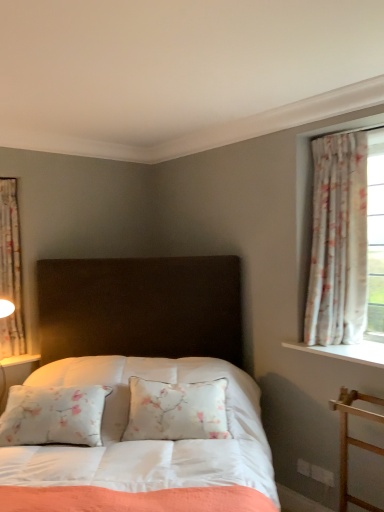
Question: Is floral fabric curtain at right, positioned as the 1th curtain in front-to-back order, surrounding floral fabric curtain at left, placed as the 2th curtain when sorted from right to left?

Choices:
 (A) no
 (B) yes

Answer: (A)

Question: Is floral fabric curtain at right, positioned as the 1th curtain in front-to-back order, not inside floral fabric curtain at left, acting as the first curtain starting from the left?

Choices:
 (A) no
 (B) yes

Answer: (B)

Question: Is floral fabric curtain at right, placed as the first curtain when sorted from right to left, to the left of floral fabric curtain at left, placed as the 2th curtain when sorted from right to left, from the viewer's perspective?

Choices:
 (A) yes
 (B) no

Answer: (B)

Question: Can you confirm if floral fabric curtain at right, which is the second curtain from left to right, is shorter than floral fabric curtain at left, acting as the second curtain starting from the front?

Choices:
 (A) yes
 (B) no

Answer: (B)

Question: Considering the relative sizes of floral fabric curtain at right, positioned as the 1th curtain in front-to-back order, and floral fabric curtain at left, placed as the 2th curtain when sorted from right to left, in the image provided, is floral fabric curtain at right, positioned as the 1th curtain in front-to-back order, taller than floral fabric curtain at left, placed as the 2th curtain when sorted from right to left,?

Choices:
 (A) yes
 (B) no

Answer: (A)

Question: From the image's perspective, is floral fabric curtain at right, positioned as the 1th curtain in front-to-back order, on top of floral fabric curtain at left, placed as the 2th curtain when sorted from right to left?

Choices:
 (A) yes
 (B) no

Answer: (A)

Question: From a real-world perspective, is floral fabric curtain at left, acting as the second curtain starting from the front, located beneath satin white bed at center?

Choices:
 (A) no
 (B) yes

Answer: (A)

Question: From the image's perspective, is floral fabric curtain at left, placed as the 2th curtain when sorted from right to left, located beneath satin white bed at center?

Choices:
 (A) yes
 (B) no

Answer: (B)

Question: Are floral fabric curtain at left, the first curtain when ordered from back to front, and satin white bed at center beside each other?

Choices:
 (A) no
 (B) yes

Answer: (A)

Question: Can you confirm if floral fabric curtain at left, acting as the second curtain starting from the front, is taller than satin white bed at center?

Choices:
 (A) no
 (B) yes

Answer: (A)

Question: Is floral fabric curtain at left, placed as the 2th curtain when sorted from right to left, aimed at satin white bed at center?

Choices:
 (A) no
 (B) yes

Answer: (B)

Question: Is floral fabric curtain at left, placed as the 2th curtain when sorted from right to left, located outside satin white bed at center?

Choices:
 (A) no
 (B) yes

Answer: (B)

Question: From the image's perspective, would you say floral fabric curtain at left, the first curtain when ordered from back to front, is shown under floral fabric curtain at right, placed as the first curtain when sorted from right to left?

Choices:
 (A) no
 (B) yes

Answer: (B)